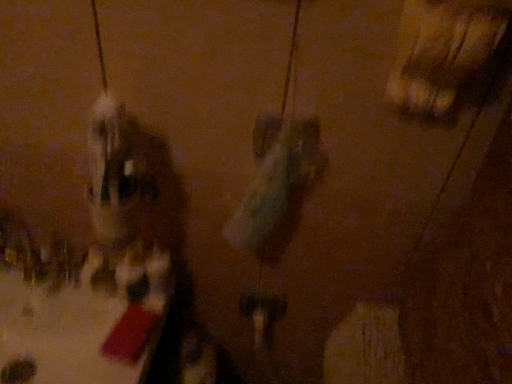
The image size is (512, 384). What do you see at coordinates (443, 50) in the screenshot?
I see `wooden chair at upper right` at bounding box center [443, 50].

Identify the location of wooden chair at upper right. The height and width of the screenshot is (384, 512). [443, 50].

Where is `wooden chair at upper right`? Image resolution: width=512 pixels, height=384 pixels. wooden chair at upper right is located at coordinates pyautogui.click(x=443, y=50).